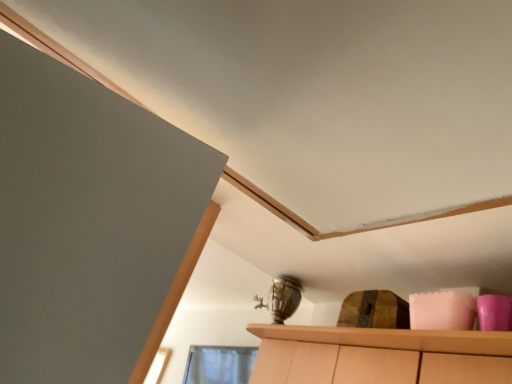
Question: Should I look upward or downward to see transparent glass window at lower center?

Choices:
 (A) up
 (B) down

Answer: (B)